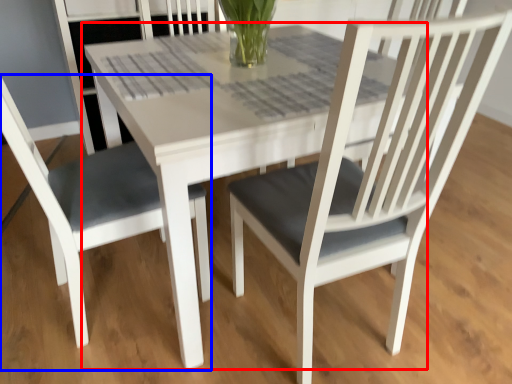
Question: Which object is further to the camera taking this photo, round table (highlighted by a red box) or chair (highlighted by a blue box)?

Choices:
 (A) round table
 (B) chair

Answer: (A)